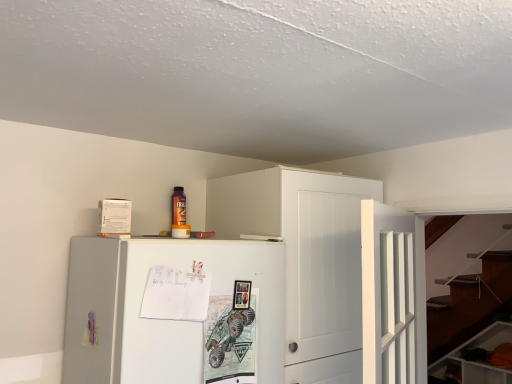
Image resolution: width=512 pixels, height=384 pixels. Describe the element at coordinates (306, 258) in the screenshot. I see `white matte cabinet at upper center, the 1th cabinetry in the left-to-right sequence` at that location.

What do you see at coordinates (393, 295) in the screenshot?
I see `white wooden door at center-right` at bounding box center [393, 295].

The image size is (512, 384). Find the location of `white matte cabinet at upper center, the second cabinetry viewed from the right`. white matte cabinet at upper center, the second cabinetry viewed from the right is located at coordinates (306, 258).

In the scene shown: Does white glossy cabinet at lower right, marked as the first cabinetry in a right-to-left arrangement, have a greater width compared to white matte cabinet at upper center, which is counted as the 2th cabinetry, starting from the bottom?

Incorrect, the width of white glossy cabinet at lower right, marked as the first cabinetry in a right-to-left arrangement, does not surpass that of white matte cabinet at upper center, which is counted as the 2th cabinetry, starting from the bottom.

From a real-world perspective, is white glossy cabinet at lower right, marked as the first cabinetry in a bottom-to-top arrangement, physically located above or below white matte cabinet at upper center, the 1th cabinetry positioned from the front?

white glossy cabinet at lower right, marked as the first cabinetry in a bottom-to-top arrangement, is situated lower than white matte cabinet at upper center, the 1th cabinetry positioned from the front, in the real world.

Would you say white glossy cabinet at lower right, marked as the first cabinetry in a right-to-left arrangement, is to the left or to the right of white matte cabinet at upper center, marked as the 2th cabinetry in a back-to-front arrangement, in the picture?

In the image, white glossy cabinet at lower right, marked as the first cabinetry in a right-to-left arrangement, appears on the right side of white matte cabinet at upper center, marked as the 2th cabinetry in a back-to-front arrangement.

Does white wooden door at center-right turn towards white matte cabinet at upper center, the 1th cabinetry positioned from the front?

No, white wooden door at center-right is not aimed at white matte cabinet at upper center, the 1th cabinetry positioned from the front.

Between white wooden door at center-right and white matte cabinet at upper center, the 1th cabinetry when ordered from top to bottom, which one has larger size?

white matte cabinet at upper center, the 1th cabinetry when ordered from top to bottom.

Considering the sizes of objects white wooden door at center-right and white matte cabinet at upper center, marked as the 2th cabinetry in a back-to-front arrangement, in the image provided, who is taller, white wooden door at center-right or white matte cabinet at upper center, marked as the 2th cabinetry in a back-to-front arrangement,?

white matte cabinet at upper center, marked as the 2th cabinetry in a back-to-front arrangement.

Between point (316, 207) and point (199, 374), which one is positioned behind?

The point (316, 207) is farther.

Which object is further away from the camera, white matte cabinet at upper center, the 1th cabinetry when ordered from top to bottom, or white matte refrigerator at center?

white matte cabinet at upper center, the 1th cabinetry when ordered from top to bottom, is further away from the camera.

From the image's perspective, which is below, white matte cabinet at upper center, which is counted as the 2th cabinetry, starting from the bottom, or white matte refrigerator at center?

white matte refrigerator at center, from the image's perspective.

From the image's perspective, is white matte refrigerator at center located above or below white wooden door at center-right?

white matte refrigerator at center is situated lower than white wooden door at center-right in the image.

Locate an element on the screen. door in front of the white matte refrigerator at center is located at coordinates (393, 295).

Considering the positions of objects white matte refrigerator at center and white wooden door at center-right in the image provided, who is in front, white matte refrigerator at center or white wooden door at center-right?

white wooden door at center-right.

From a real-world perspective, between white matte refrigerator at center and white wooden door at center-right, who is vertically higher?

Answer: white wooden door at center-right.

In the scene shown: Which of these two, white wooden door at center-right or white matte refrigerator at center, is thinner?

white wooden door at center-right is thinner.

Considering the sizes of objects white wooden door at center-right and white matte refrigerator at center in the image provided, who is shorter, white wooden door at center-right or white matte refrigerator at center?

white matte refrigerator at center.

Is white wooden door at center-right beside white matte refrigerator at center?

white wooden door at center-right and white matte refrigerator at center are not in contact.

Can you confirm if white glossy cabinet at lower right, the second cabinetry positioned from the left, is thinner than white matte refrigerator at center?

Yes.

Looking at this image, from the image's perspective, which one is positioned lower, white glossy cabinet at lower right, marked as the first cabinetry in a bottom-to-top arrangement, or white matte refrigerator at center?

white glossy cabinet at lower right, marked as the first cabinetry in a bottom-to-top arrangement, is shown below in the image.

Based on the photo, is white glossy cabinet at lower right, the second cabinetry from the front, in front of white matte refrigerator at center?

No, the depth of white glossy cabinet at lower right, the second cabinetry from the front, is greater than that of white matte refrigerator at center.

Is white wooden door at center-right shorter than white glossy cabinet at lower right, marked as the first cabinetry in a bottom-to-top arrangement?

No, white wooden door at center-right is not shorter than white glossy cabinet at lower right, marked as the first cabinetry in a bottom-to-top arrangement.

Does white wooden door at center-right turn towards white glossy cabinet at lower right, marked as the first cabinetry in a right-to-left arrangement?

No, white wooden door at center-right does not turn towards white glossy cabinet at lower right, marked as the first cabinetry in a right-to-left arrangement.

Is white glossy cabinet at lower right, marked as the first cabinetry in a right-to-left arrangement, a part of white wooden door at center-right?

No, white glossy cabinet at lower right, marked as the first cabinetry in a right-to-left arrangement, is not inside white wooden door at center-right.

Is white wooden door at center-right far away from white glossy cabinet at lower right, marked as the first cabinetry in a right-to-left arrangement?

Yes, white wooden door at center-right is far from white glossy cabinet at lower right, marked as the first cabinetry in a right-to-left arrangement.

Where is `cabinetry on the right of white matte cabinet at upper center, marked as the 2th cabinetry in a back-to-front arrangement`? This screenshot has width=512, height=384. cabinetry on the right of white matte cabinet at upper center, marked as the 2th cabinetry in a back-to-front arrangement is located at coordinates (478, 360).

Locate an element on the screen. The image size is (512, 384). door that is above the white matte cabinet at upper center, the 1th cabinetry positioned from the front (from a real-world perspective) is located at coordinates (x=393, y=295).

Which object lies further to the anchor point white wooden door at center-right, white matte refrigerator at center or white glossy cabinet at lower right, marked as the first cabinetry in a bottom-to-top arrangement?

white glossy cabinet at lower right, marked as the first cabinetry in a bottom-to-top arrangement, is positioned further to the anchor white wooden door at center-right.

Based on their spatial positions, is white matte cabinet at upper center, the 1th cabinetry in the left-to-right sequence, or white matte refrigerator at center further from white wooden door at center-right?

white matte refrigerator at center is further to white wooden door at center-right.

Looking at the image, which one is located further to white matte refrigerator at center, white wooden door at center-right or white matte cabinet at upper center, the second cabinetry viewed from the right?

white wooden door at center-right is further to white matte refrigerator at center.

Looking at the image, which one is located further to white wooden door at center-right, white glossy cabinet at lower right, marked as the first cabinetry in a right-to-left arrangement, or white matte refrigerator at center?

white glossy cabinet at lower right, marked as the first cabinetry in a right-to-left arrangement.

Considering their positions, is white wooden door at center-right positioned further to white matte cabinet at upper center, marked as the 2th cabinetry in a back-to-front arrangement, than white glossy cabinet at lower right, marked as the first cabinetry in a right-to-left arrangement?

white glossy cabinet at lower right, marked as the first cabinetry in a right-to-left arrangement.

Considering their positions, is white matte cabinet at upper center, the 1th cabinetry positioned from the front, positioned closer to white matte refrigerator at center than white wooden door at center-right?

The object closer to white matte refrigerator at center is white matte cabinet at upper center, the 1th cabinetry positioned from the front.

Estimate the real-world distances between objects in this image. Which object is further from white matte cabinet at upper center, marked as the 2th cabinetry in a back-to-front arrangement, white glossy cabinet at lower right, placed as the 1th cabinetry when sorted from back to front, or white wooden door at center-right?

white glossy cabinet at lower right, placed as the 1th cabinetry when sorted from back to front, is positioned further to the anchor white matte cabinet at upper center, marked as the 2th cabinetry in a back-to-front arrangement.

Looking at the image, which one is located closer to white glossy cabinet at lower right, placed as the 1th cabinetry when sorted from back to front, white wooden door at center-right or white matte refrigerator at center?

white wooden door at center-right.

At what (x,y) coordinates should I click in order to perform the action: click on cabinetry positioned between white wooden door at center-right and white glossy cabinet at lower right, marked as the first cabinetry in a bottom-to-top arrangement, from near to far. Please return your answer as a coordinate pair (x, y). Looking at the image, I should click on (306, 258).

At what (x,y) coordinates should I click in order to perform the action: click on refrigerator between white wooden door at center-right and white glossy cabinet at lower right, the second cabinetry when ordered from top to bottom, along the z-axis. Please return your answer as a coordinate pair (x, y). Looking at the image, I should click on (158, 319).

Locate an element on the screen. This screenshot has height=384, width=512. cabinetry located between white matte refrigerator at center and white wooden door at center-right in the left-right direction is located at coordinates click(306, 258).

At what (x,y) coordinates should I click in order to perform the action: click on cabinetry situated between white matte refrigerator at center and white glossy cabinet at lower right, marked as the first cabinetry in a right-to-left arrangement, from left to right. Please return your answer as a coordinate pair (x, y). The width and height of the screenshot is (512, 384). Looking at the image, I should click on (306, 258).